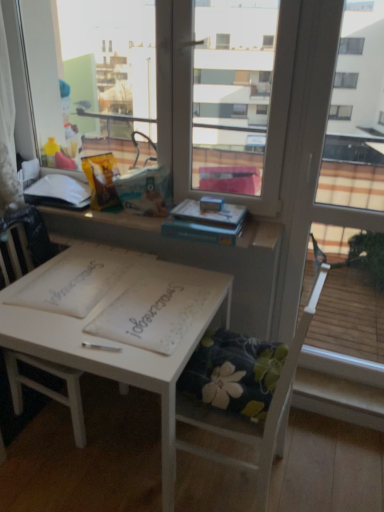
In order to click on white matte book at upper left, acting as the 2th book starting from the front in this screenshot , I will do `click(58, 192)`.

The height and width of the screenshot is (512, 384). What are the coordinates of `white plastic window sill at lower right` in the screenshot? It's located at (340, 387).

In order to face white plastic window sill at lower right, should I rotate leftwards or rightwards?

Rotate your view right by about 19.656°.

Locate an element on the screen. This screenshot has width=384, height=512. white paper notebook at center, which appears as the second notebook when viewed from the left is located at coordinates (151, 314).

Measure the distance between point (280, 430) and camera.

Point (280, 430) is 4.91 feet away from camera.

In order to face white paper notebook at center, the 1th notebook in the left-to-right sequence, should I rotate leftwards or rightwards?

Rotate your view left by about 14.975°.

The height and width of the screenshot is (512, 384). In order to click on white matte book at upper left, marked as the 1th book in a back-to-front arrangement in this screenshot , I will do `click(58, 192)`.

Which is more to the left, floral fabric cushion at lower center, the 2th chair when ordered from left to right, or white painted wood table at center?

Positioned to the left is white painted wood table at center.

In the image, is floral fabric cushion at lower center, the 2th chair when ordered from left to right, positioned in front of or behind white painted wood table at center?

In the image, floral fabric cushion at lower center, the 2th chair when ordered from left to right, appears in front of white painted wood table at center.

Considering the sizes of objects white paper notebook at center, marked as the 2th notebook in a right-to-left arrangement, and white wood chair at center, which is the 1th chair in left-to-right order, in the image provided, who is shorter, white paper notebook at center, marked as the 2th notebook in a right-to-left arrangement, or white wood chair at center, which is the 1th chair in left-to-right order,?

white paper notebook at center, marked as the 2th notebook in a right-to-left arrangement.

Find the location of a particular element. This screenshot has width=384, height=512. the 1st chair in front of the white paper notebook at center, marked as the 2th notebook in a right-to-left arrangement, starting your count from the anchor is located at coordinates point(47,389).

Considering the relative positions of white paper notebook at center, the 1th notebook in the left-to-right sequence, and white wood chair at center, positioned as the second chair in right-to-left order, in the image provided, is white paper notebook at center, the 1th notebook in the left-to-right sequence, to the left of white wood chair at center, positioned as the second chair in right-to-left order, from the viewer's perspective?

Incorrect, white paper notebook at center, the 1th notebook in the left-to-right sequence, is not on the left side of white wood chair at center, positioned as the second chair in right-to-left order.

Considering the relative positions of white paper notebook at center, marked as the 2th notebook in a right-to-left arrangement, and white wood chair at center, positioned as the second chair in right-to-left order, in the image provided, is white paper notebook at center, marked as the 2th notebook in a right-to-left arrangement, behind white wood chair at center, positioned as the second chair in right-to-left order,?

Yes, it is behind white wood chair at center, positioned as the second chair in right-to-left order.

From the picture: Between hardcover book at upper center, which appears as the second book when viewed from the back, and white paper notebook at center, marked as the 2th notebook in a right-to-left arrangement, which one has smaller width?

white paper notebook at center, marked as the 2th notebook in a right-to-left arrangement, is thinner.

Is hardcover book at upper center, the 1th book in the right-to-left sequence, positioned behind white paper notebook at center, marked as the 2th notebook in a right-to-left arrangement?

Yes, hardcover book at upper center, the 1th book in the right-to-left sequence, is further from the viewer.

Considering the positions of objects hardcover book at upper center, the first book positioned from the front, and white paper notebook at center, the 1th notebook in the left-to-right sequence, in the image provided, who is more to the left, hardcover book at upper center, the first book positioned from the front, or white paper notebook at center, the 1th notebook in the left-to-right sequence,?

From the viewer's perspective, white paper notebook at center, the 1th notebook in the left-to-right sequence, appears more on the left side.

From the image's perspective, does white paper notebook at center, which appears as the second notebook when viewed from the left, appear higher than white paper notebook at center, the 1th notebook in the left-to-right sequence?

No, from the image's perspective, white paper notebook at center, which appears as the second notebook when viewed from the left, is not on top of white paper notebook at center, the 1th notebook in the left-to-right sequence.

Is white paper notebook at center, the 1th notebook in the left-to-right sequence, located within white paper notebook at center, which is the 1th notebook from right to left?

No, white paper notebook at center, the 1th notebook in the left-to-right sequence, is not a part of white paper notebook at center, which is the 1th notebook from right to left.

Can you confirm if white paper notebook at center, which is the 1th notebook from right to left, is bigger than white paper notebook at center, the 1th notebook in the left-to-right sequence?

Indeed, white paper notebook at center, which is the 1th notebook from right to left, has a larger size compared to white paper notebook at center, the 1th notebook in the left-to-right sequence.

Who is shorter, floral fabric cushion at lower center, the 1th chair when ordered from right to left, or hardcover book at upper center, arranged as the second book when viewed from the left?

With less height is hardcover book at upper center, arranged as the second book when viewed from the left.

From a real-world perspective, between floral fabric cushion at lower center, the 1th chair when ordered from right to left, and hardcover book at upper center, the first book positioned from the front, who is vertically higher?

hardcover book at upper center, the first book positioned from the front, from a real-world perspective.

Would you say floral fabric cushion at lower center, the 1th chair when ordered from right to left, is inside or outside hardcover book at upper center, the first book positioned from the front?

floral fabric cushion at lower center, the 1th chair when ordered from right to left, is outside hardcover book at upper center, the first book positioned from the front.

Does point (26, 284) come in front of point (225, 232)?

That is False.

Who is shorter, white painted wood table at center or hardcover book at upper center, the 1th book in the right-to-left sequence?

With less height is hardcover book at upper center, the 1th book in the right-to-left sequence.

Looking at the image, does white painted wood table at center seem bigger or smaller compared to hardcover book at upper center, arranged as the second book when viewed from the left?

white painted wood table at center is bigger than hardcover book at upper center, arranged as the second book when viewed from the left.

Would you say white painted wood table at center is a long distance from hardcover book at upper center, the first book positioned from the front?

No.

From the image's perspective, which is above, white paper notebook at center, which is the 1th notebook from right to left, or white matte book at upper left, the first book in the left-to-right sequence?

From the image's view, white matte book at upper left, the first book in the left-to-right sequence, is above.

Considering the sizes of objects white paper notebook at center, which is the 1th notebook from right to left, and white matte book at upper left, acting as the second book starting from the right, in the image provided, who is shorter, white paper notebook at center, which is the 1th notebook from right to left, or white matte book at upper left, acting as the second book starting from the right,?

white paper notebook at center, which is the 1th notebook from right to left, is shorter.

Who is smaller, white paper notebook at center, which appears as the second notebook when viewed from the left, or white matte book at upper left, marked as the 1th book in a back-to-front arrangement?

white paper notebook at center, which appears as the second notebook when viewed from the left.

Where is `the 1st chair positioned above the white painted wood table at center (from the image's perspective)`? The width and height of the screenshot is (384, 512). the 1st chair positioned above the white painted wood table at center (from the image's perspective) is located at coordinates (250, 422).

Identify the location of notebook that is the 1st object above the white wood chair at center, which is the 1th chair in left-to-right order (from a real-world perspective). (77, 280).

Estimate the real-world distances between objects in this image. Which object is closer to white painted wood table at center, hardcover book at upper center, arranged as the second book when viewed from the left, or white wood chair at center, positioned as the second chair in right-to-left order?

hardcover book at upper center, arranged as the second book when viewed from the left, is positioned closer to the anchor white painted wood table at center.

Estimate the real-world distances between objects in this image. Which object is closer to hardcover book at upper center, which appears as the second book when viewed from the back, floral fabric cushion at lower center, the 1th chair when ordered from right to left, or white matte book at upper left, acting as the 2th book starting from the front?

floral fabric cushion at lower center, the 1th chair when ordered from right to left.

Which object lies nearer to the anchor point white paper notebook at center, which is the 1th notebook from right to left, white paper notebook at center, marked as the 2th notebook in a right-to-left arrangement, or white matte book at upper left, acting as the second book starting from the right?

white paper notebook at center, marked as the 2th notebook in a right-to-left arrangement, lies closer to white paper notebook at center, which is the 1th notebook from right to left, than the other object.

Based on their spatial positions, is white matte book at upper left, marked as the 1th book in a back-to-front arrangement, or hardcover book at upper center, which appears as the second book when viewed from the back, further from white paper notebook at center, which appears as the second notebook when viewed from the left?

white matte book at upper left, marked as the 1th book in a back-to-front arrangement.

Estimate the real-world distances between objects in this image. Which object is further from white wood chair at center, which is the 1th chair in left-to-right order, white plastic window sill at lower right or white paper notebook at center, which is the 1th notebook from right to left?

Among the two, white plastic window sill at lower right is located further to white wood chair at center, which is the 1th chair in left-to-right order.

Considering their positions, is floral fabric cushion at lower center, the 1th chair when ordered from right to left, positioned further to white paper notebook at center, the 1th notebook in the left-to-right sequence, than hardcover book at upper center, the 1th book in the right-to-left sequence?

floral fabric cushion at lower center, the 1th chair when ordered from right to left, is further to white paper notebook at center, the 1th notebook in the left-to-right sequence.

Which object lies nearer to the anchor point hardcover book at upper center, the 1th book in the right-to-left sequence, white wood chair at center, which is the 1th chair in left-to-right order, or white plastic window sill at lower right?

white wood chair at center, which is the 1th chair in left-to-right order, is positioned closer to the anchor hardcover book at upper center, the 1th book in the right-to-left sequence.

Estimate the real-world distances between objects in this image. Which object is closer to white paper notebook at center, which is the 1th notebook from right to left, white plastic window sill at lower right or white wood chair at center, which is the 1th chair in left-to-right order?

Among the two, white wood chair at center, which is the 1th chair in left-to-right order, is located nearer to white paper notebook at center, which is the 1th notebook from right to left.

Identify the location of chair between white paper notebook at center, which appears as the second notebook when viewed from the left, and white plastic window sill at lower right. (250, 422).

Locate an element on the screen. The image size is (384, 512). chair between white paper notebook at center, the 1th notebook in the left-to-right sequence, and white plastic window sill at lower right from left to right is located at coordinates (250, 422).

Locate an element on the screen. This screenshot has height=512, width=384. book between white painted wood table at center and white plastic window sill at lower right in the horizontal direction is located at coordinates (205, 222).

Identify the location of table located between white wood chair at center, which is the 1th chair in left-to-right order, and white plastic window sill at lower right in the left-right direction. This screenshot has height=512, width=384. (115, 324).